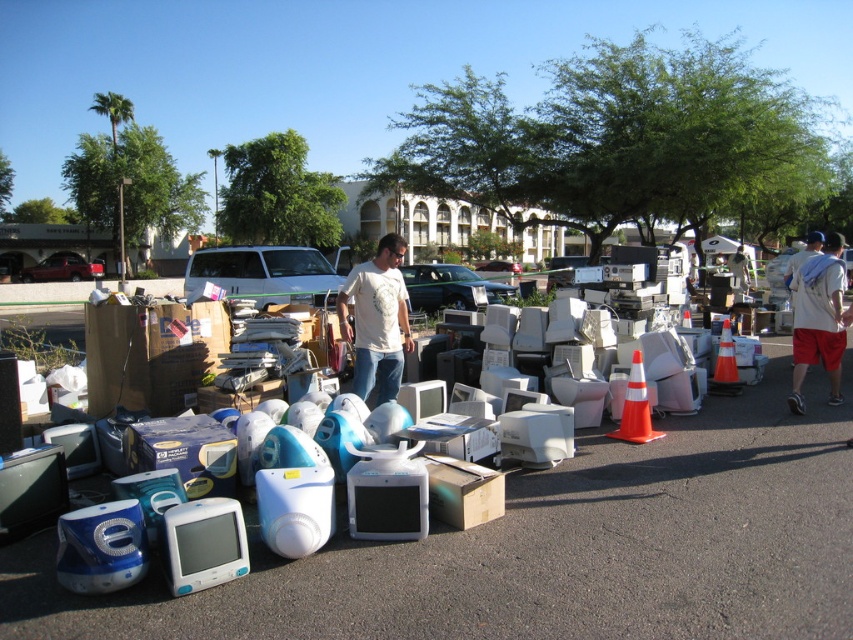
Can you confirm if white t-shirt at center is taller than white cotton shirt at center?

Indeed, white t-shirt at center has a greater height compared to white cotton shirt at center.

Can you confirm if white t-shirt at center is positioned above white cotton shirt at center?

Incorrect, white t-shirt at center is not positioned above white cotton shirt at center.

The width and height of the screenshot is (853, 640). What do you see at coordinates (376, 320) in the screenshot? I see `white t-shirt at center` at bounding box center [376, 320].

Locate an element on the screen. white t-shirt at center is located at coordinates (376, 320).